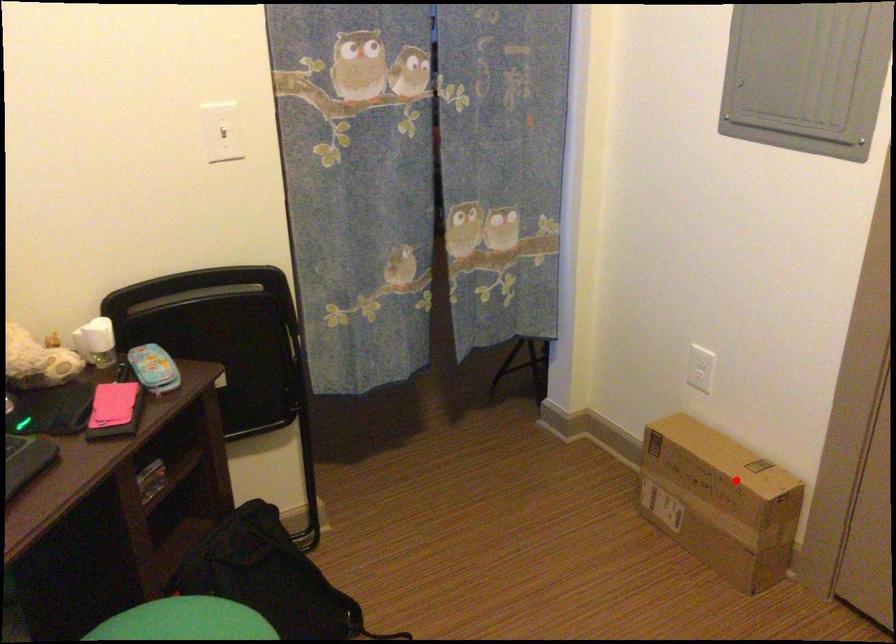
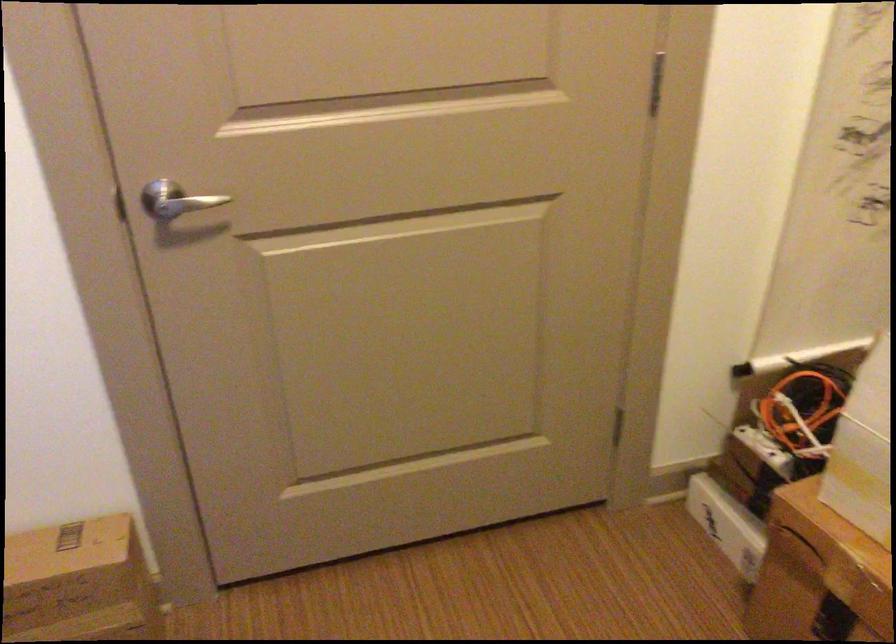
Find the pixel in the second image that matches the highlighted location in the first image.

(79, 583)